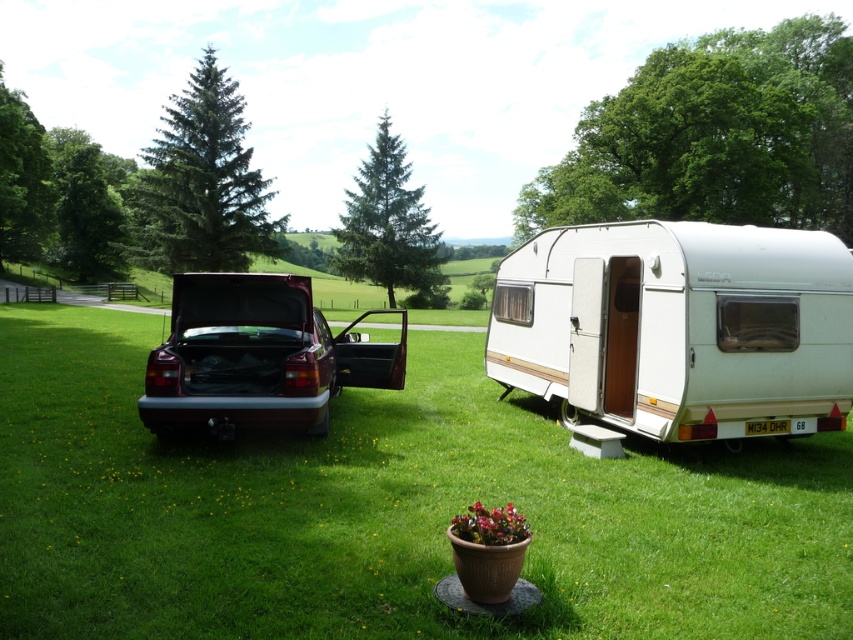
Question: Which object appears farthest from the camera in this image?

Choices:
 (A) maroon metallic car at center
 (B) green grass at center
 (C) white plastic trailer at right

Answer: (C)

Question: Can you confirm if white plastic trailer at right is positioned below maroon metallic car at center?

Choices:
 (A) yes
 (B) no

Answer: (A)

Question: Can you confirm if green grass at center is wider than white plastic trailer at right?

Choices:
 (A) yes
 (B) no

Answer: (A)

Question: Is green grass at center closer to the viewer compared to white plastic trailer at right?

Choices:
 (A) yes
 (B) no

Answer: (A)

Question: Which of the following is the farthest from the observer?

Choices:
 (A) (196, 417)
 (B) (329, 561)

Answer: (A)

Question: Which object appears farthest from the camera in this image?

Choices:
 (A) white plastic trailer at right
 (B) maroon metallic car at center
 (C) green grass at center

Answer: (A)